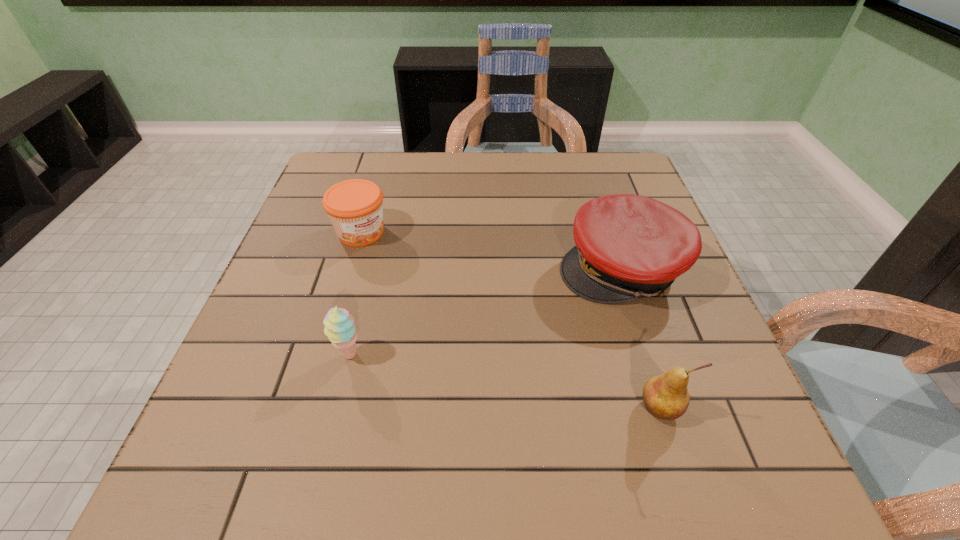
This screenshot has width=960, height=540. In order to click on sherbert in this screenshot , I will do `click(340, 329)`.

Locate an element on the screen. This screenshot has width=960, height=540. the nearest object is located at coordinates (666, 397).

Locate an element on the screen. The width and height of the screenshot is (960, 540). jam is located at coordinates (355, 207).

The height and width of the screenshot is (540, 960). I want to click on cap, so click(x=628, y=246).

Locate an element on the screen. blank area located on the back of the second nearest object is located at coordinates (364, 300).

This screenshot has width=960, height=540. Find the location of `vacant space located 0.170m on the back of the pear`. vacant space located 0.170m on the back of the pear is located at coordinates (631, 316).

The width and height of the screenshot is (960, 540). Identify the location of vacant space located on the front label of the jam. (443, 305).

At what (x,y) coordinates should I click in order to perform the action: click on vacant space located on the front label of the jam. Please return your answer as a coordinate pair (x, y). The height and width of the screenshot is (540, 960). Looking at the image, I should click on (394, 261).

Identify the location of free space located 0.360m on the front label of the jam. (478, 336).

This screenshot has height=540, width=960. I want to click on vacant space situated on the front of the cap with an emblem, so click(531, 324).